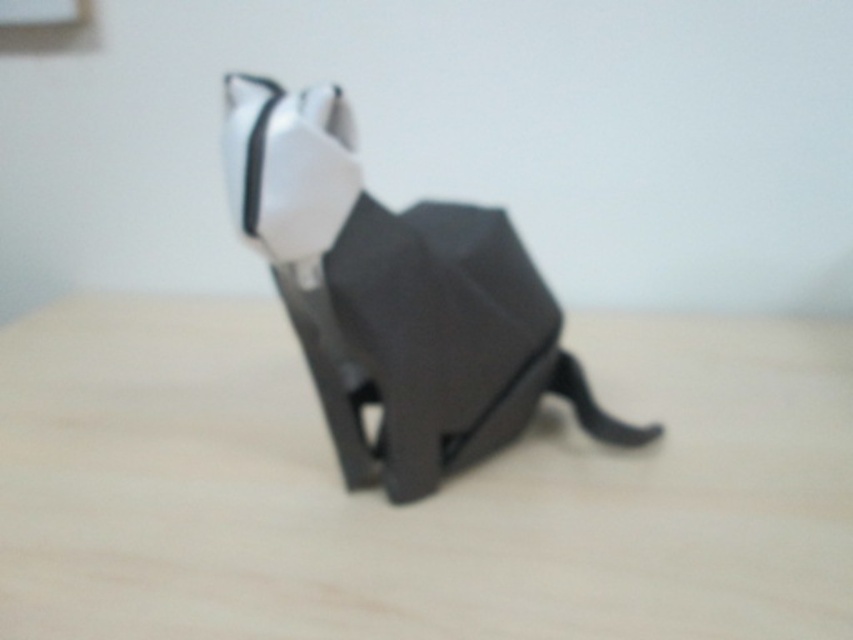
Question: Does wooden table at center come in front of white matte bow tie at center?

Choices:
 (A) yes
 (B) no

Answer: (B)

Question: Is wooden table at center to the right of white matte bow tie at center from the viewer's perspective?

Choices:
 (A) yes
 (B) no

Answer: (B)

Question: Which object appears closest to the camera in this image?

Choices:
 (A) wooden table at center
 (B) white matte bow tie at center

Answer: (B)

Question: Which of the following is the farthest from the observer?

Choices:
 (A) white matte bow tie at center
 (B) wooden table at center

Answer: (B)

Question: In this image, where is wooden table at center located relative to white matte bow tie at center?

Choices:
 (A) left
 (B) right

Answer: (A)